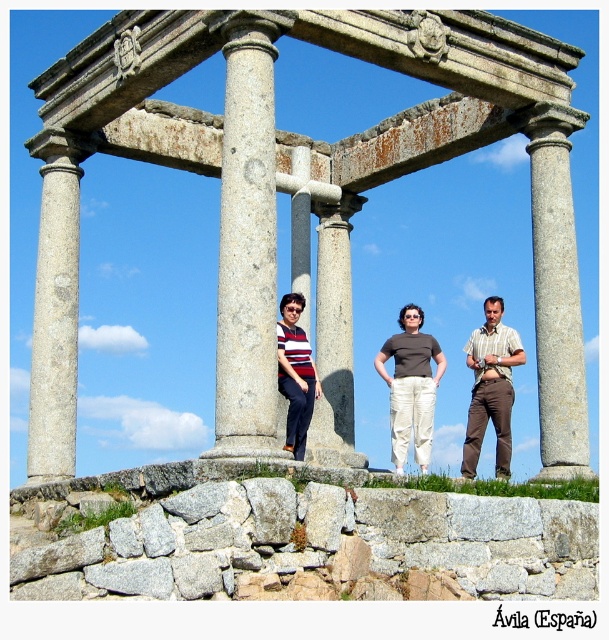
Between gray stone column at left and smooth stone column at center, which one is positioned lower?

Positioned lower is gray stone column at left.

Can you confirm if gray stone column at left is thinner than smooth stone column at center?

No.

Who is more distant from viewer, [48,193] or [362,196]?

The point [362,196] is behind.

Locate an element on the screen. Image resolution: width=609 pixels, height=640 pixels. gray stone column at left is located at coordinates (54, 316).

Does gray stone column at right have a larger size compared to gray stone column at left?

Incorrect, gray stone column at right is not larger than gray stone column at left.

Does point (560, 272) come in front of point (48, 387)?

Yes, it is in front of point (48, 387).

Locate an element on the screen. gray stone column at right is located at coordinates (557, 292).

Is gray stone ruins at center wider than gray stone column at left?

Yes, gray stone ruins at center is wider than gray stone column at left.

Is point (343, 248) closer to viewer compared to point (65, 460)?

No, (343, 248) is behind (65, 460).

Consider the image. Who is more forward, (x=76, y=372) or (x=48, y=221)?

Point (x=76, y=372)

This screenshot has height=640, width=609. I want to click on gray stone ruins at center, so click(311, 200).